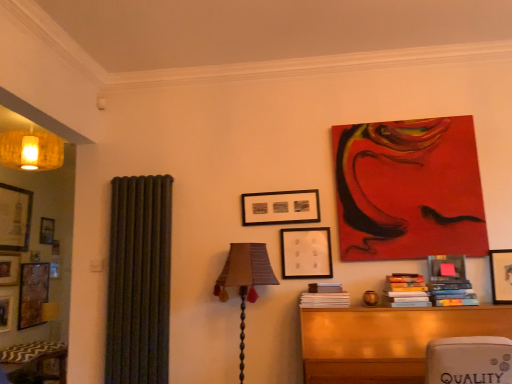
Locate an element on the screen. Image resolution: width=512 pixels, height=384 pixels. vacant region above hardcover books at right, placed as the first book when sorted from right to left (from a real-world perspective) is located at coordinates (449, 272).